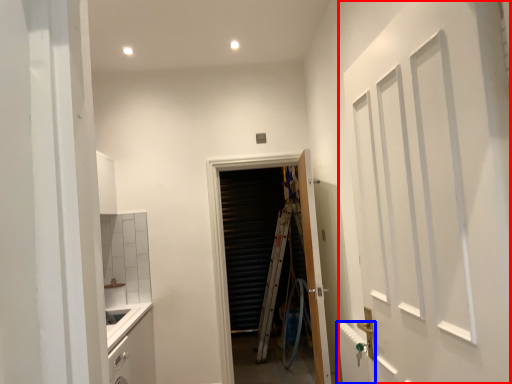
Question: Among these objects, which one is nearest to the camera, door (highlighted by a red box) or radiator (highlighted by a blue box)?

Choices:
 (A) door
 (B) radiator

Answer: (A)